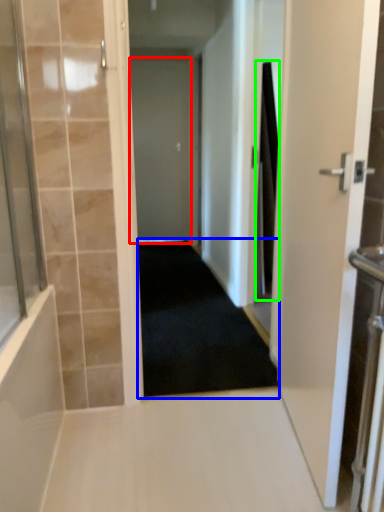
Question: Based on their relative distances, which object is nearer to door (highlighted by a red box)? Choose from corridor (highlighted by a blue box) and shower curtain (highlighted by a green box).

Choices:
 (A) corridor
 (B) shower curtain

Answer: (A)